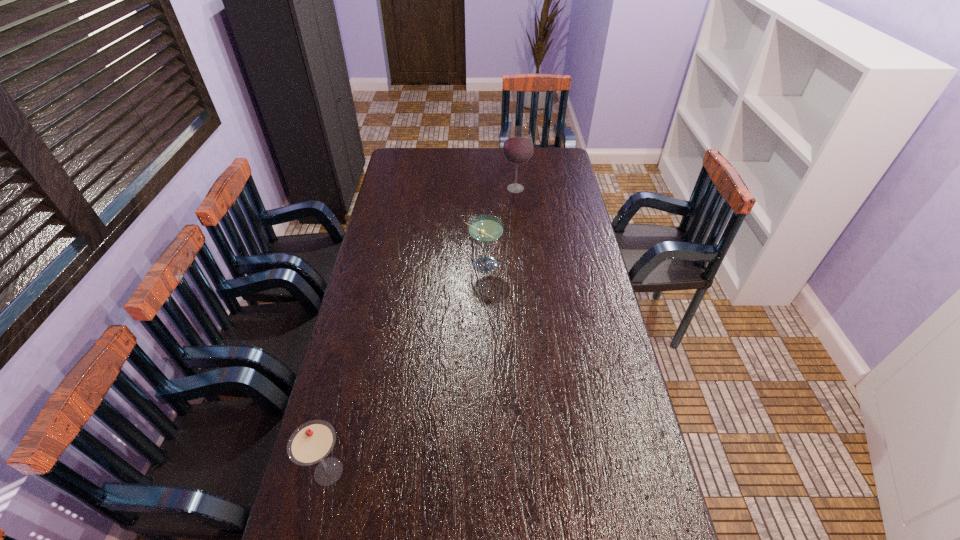
The image size is (960, 540). In the image, there is a desktop. Find the location of `vacant area at the far edge`. vacant area at the far edge is located at coordinates (494, 155).

Identify the location of vacant space at the left edge of the desktop. This screenshot has height=540, width=960. (392, 219).

The image size is (960, 540). In order to click on free region at the right edge in this screenshot , I will do `click(563, 178)`.

Locate an element on the screen. The width and height of the screenshot is (960, 540). vacant region at the far right corner of the desktop is located at coordinates (538, 161).

Locate an element on the screen. vacant point located between the rightmost object and the nearer martini is located at coordinates (422, 330).

At what (x,y) coordinates should I click in order to perform the action: click on free space that is in between the second farthest object and the leftmost object. Please return your answer as a coordinate pair (x, y). Looking at the image, I should click on (406, 368).

Where is `vacant space that is in between the leftmost object and the farther martini`? The width and height of the screenshot is (960, 540). vacant space that is in between the leftmost object and the farther martini is located at coordinates (406, 368).

Where is `free space between the alcohol and the nearer martini`? The image size is (960, 540). free space between the alcohol and the nearer martini is located at coordinates (422, 330).

Where is `vacant area that lies between the second object from left to right and the nearer martini`? vacant area that lies between the second object from left to right and the nearer martini is located at coordinates (406, 368).

Locate an element on the screen. empty space that is in between the alcohol and the nearest object is located at coordinates (422, 330).